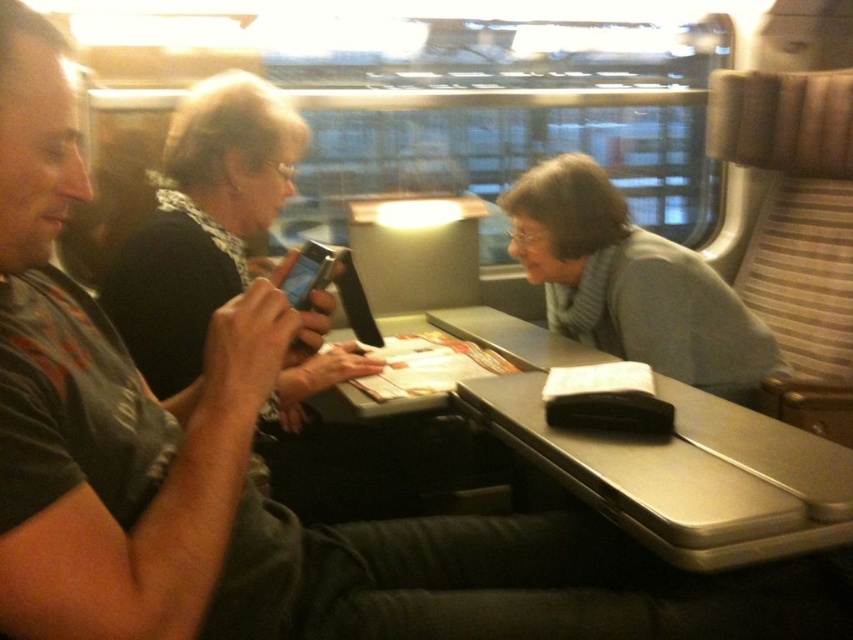
Which is below, black leather table at center or gray knitted scarf at center?

black leather table at center is below.

Which is in front, point (532, 401) or point (676, 266)?

Point (532, 401) is in front.

Identify the location of black leather table at center. (686, 474).

Locate an element on the screen. Image resolution: width=853 pixels, height=640 pixels. black leather table at center is located at coordinates (686, 474).